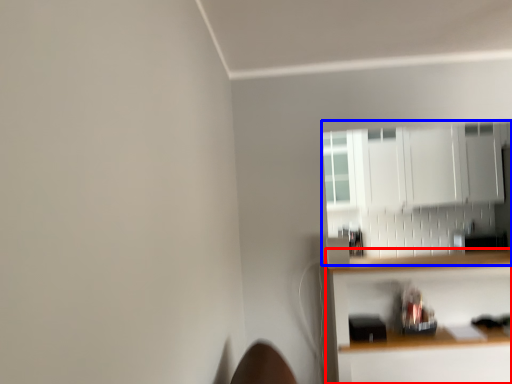
Question: Which object is closer to the camera taking this photo, shelf (highlighted by a red box) or cabinetry (highlighted by a blue box)?

Choices:
 (A) shelf
 (B) cabinetry

Answer: (A)